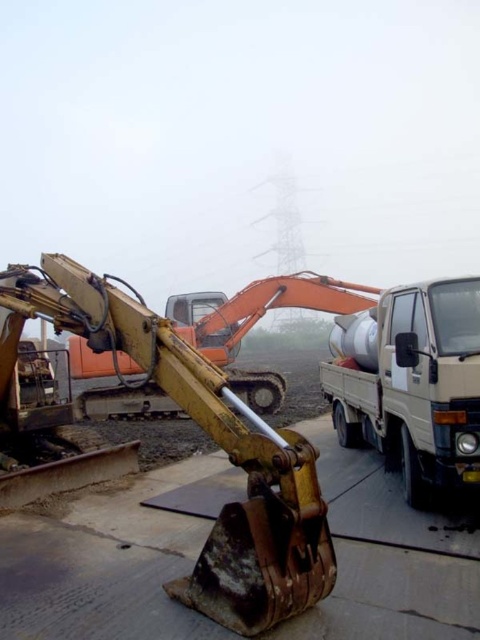
Who is taller, rusty metal cement at lower center or white matte truck at lower right?

Standing taller between the two is white matte truck at lower right.

Can you confirm if rusty metal cement at lower center is smaller than white matte truck at lower right?

Yes, rusty metal cement at lower center is smaller than white matte truck at lower right.

Image resolution: width=480 pixels, height=640 pixels. In order to click on rusty metal cement at lower center in this screenshot , I will do `click(108, 563)`.